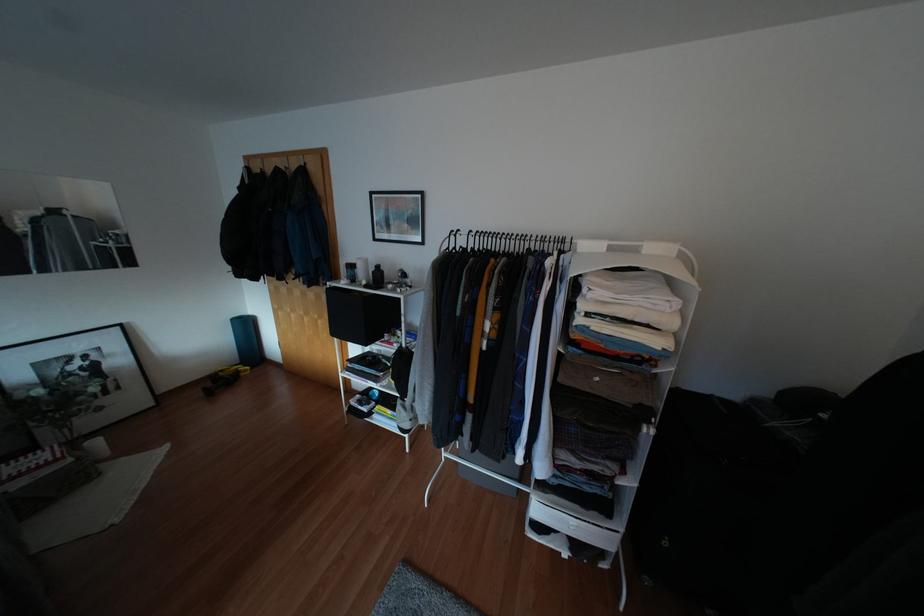
Describe the element at coordinates (224, 384) in the screenshot. I see `the yellow drill handle` at that location.